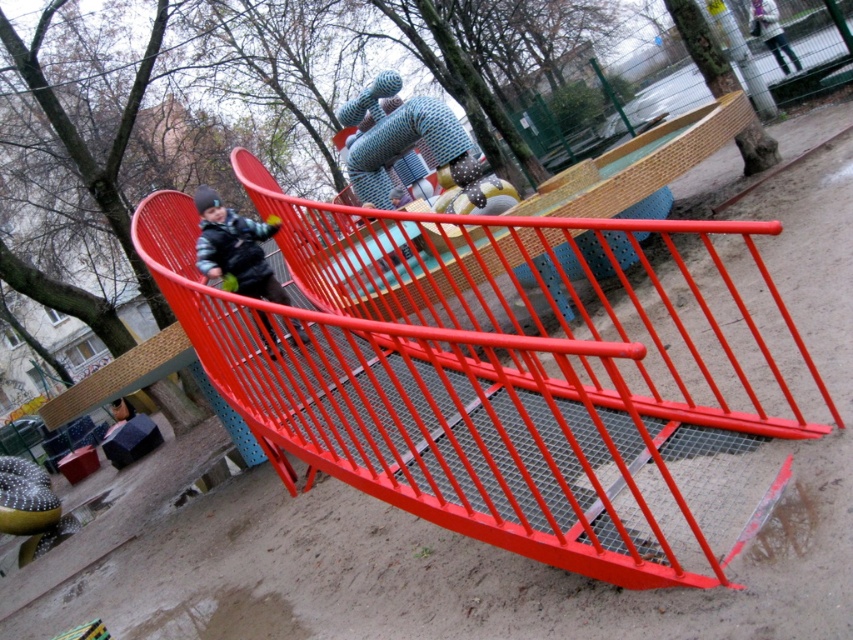
Which of these two, metallic red slide at center or matte black jacket at left, stands taller?

metallic red slide at center

Can you confirm if metallic red slide at center is positioned to the right of matte black jacket at left?

Indeed, metallic red slide at center is positioned on the right side of matte black jacket at left.

Where is `metallic red slide at center`? metallic red slide at center is located at coordinates point(442,419).